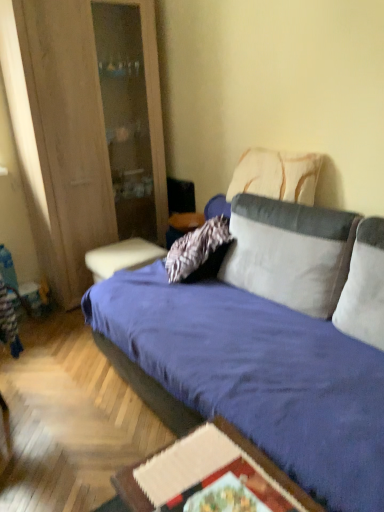
Question: Considering the positions of point (289, 189) and point (87, 22), is point (289, 189) closer or farther from the camera than point (87, 22)?

Choices:
 (A) closer
 (B) farther

Answer: (A)

Question: Is white textured pillow at upper right, the 1th pillow viewed from the back, wider or thinner than wooden cabinet at left?

Choices:
 (A) wide
 (B) thin

Answer: (B)

Question: Which is farther from the velvet blue studio couch at center?

Choices:
 (A) wooden textured table at lower center, positioned as the 2th table in left-to-right order
 (B) white soft pillow at right, the 3th pillow positioned from the back
 (C) wooden cabinet at left
 (D) white textured pillow at upper right, the 1th pillow viewed from the back
 (E) matte blue table at center, positioned as the 2th table in right-to-left order

Answer: (C)

Question: Which object is the farthest from the wooden textured table at lower center, arranged as the first table when ordered from the bottom?

Choices:
 (A) white soft pillow at right, which is the first pillow from front to back
 (B) velvet blue studio couch at center
 (C) velvety white pillow at center, the 2th pillow when ordered from front to back
 (D) white textured pillow at upper right, the 1th pillow viewed from the back
 (E) matte blue table at center, the second table viewed from the front

Answer: (E)